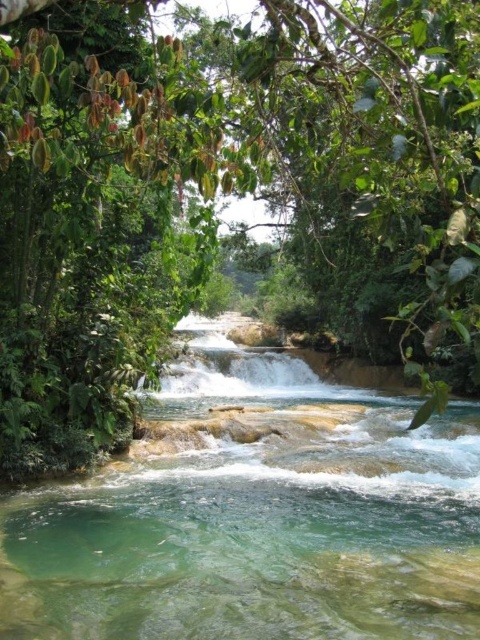
Question: Is green leafy tree at center wider than clear water stream at center?

Choices:
 (A) no
 (B) yes

Answer: (B)

Question: Is the position of green leafy tree at center less distant than that of clear water stream at center?

Choices:
 (A) yes
 (B) no

Answer: (A)

Question: Which point is farther to the camera?

Choices:
 (A) green leafy tree at center
 (B) clear water stream at center

Answer: (B)

Question: Where is green leafy tree at center located in relation to clear water stream at center in the image?

Choices:
 (A) below
 (B) above

Answer: (B)